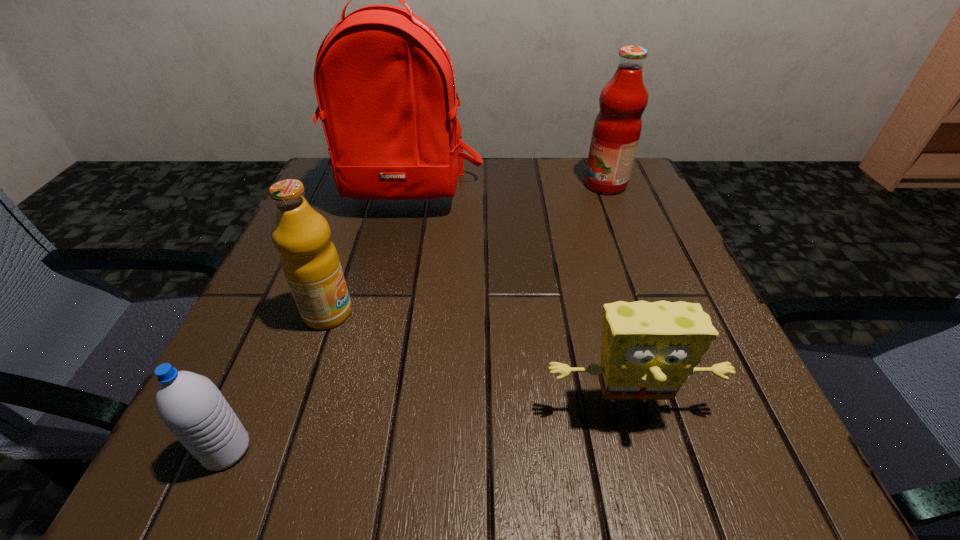
At what (x,y) coordinates should I click in order to perform the action: click on vacant point at the far left corner. Please return your answer as a coordinate pair (x, y). Image resolution: width=960 pixels, height=540 pixels. Looking at the image, I should click on coord(318,177).

Identify the location of vacant area between the water bottle and the third tallest object. This screenshot has height=540, width=960. (277, 381).

At what (x,y) coordinates should I click in order to perform the action: click on free spot between the water bottle and the nearer fruit juice. Please return your answer as a coordinate pair (x, y). Looking at the image, I should click on (277, 381).

Locate an element on the screen. vacant area that lies between the left fruit juice and the sponge is located at coordinates (478, 361).

Find the location of a particular element. The image size is (960, 540). empty space between the second tallest object and the sponge is located at coordinates (616, 297).

Identify the location of vacant area that lies between the sponge and the water bottle. Image resolution: width=960 pixels, height=540 pixels. (427, 430).

Where is `unoccupied area between the third tallest object and the tallest object`? The width and height of the screenshot is (960, 540). unoccupied area between the third tallest object and the tallest object is located at coordinates (367, 254).

Locate an element on the screen. Image resolution: width=960 pixels, height=540 pixels. empty space that is in between the third tallest object and the water bottle is located at coordinates (277, 381).

Where is `blank region between the shorter fruit juice and the backpack`? Image resolution: width=960 pixels, height=540 pixels. blank region between the shorter fruit juice and the backpack is located at coordinates (367, 254).

Choose which object is the third nearest neighbor to the tallest object. Please provide its 2D coordinates. Your answer should be formatted as a tuple, i.e. [(x, y)], where the tuple contains the x and y coordinates of a point satisfying the conditions above.

[(648, 350)]